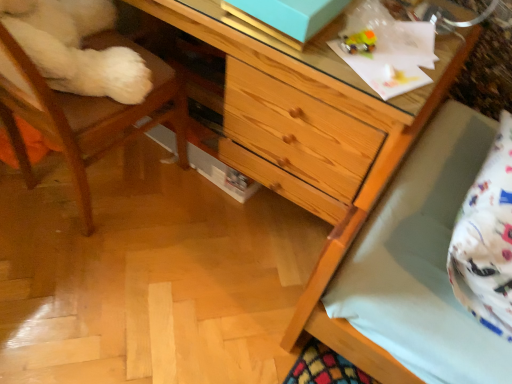
Question: Considering the relative positions of translucent plastic toy at upper right and wooden chest of drawers at center in the image provided, is translucent plastic toy at upper right behind wooden chest of drawers at center?

Choices:
 (A) yes
 (B) no

Answer: (A)

Question: From a real-world perspective, is translucent plastic toy at upper right over wooden chest of drawers at center?

Choices:
 (A) yes
 (B) no

Answer: (A)

Question: Is translucent plastic toy at upper right positioned with its back to wooden chest of drawers at center?

Choices:
 (A) yes
 (B) no

Answer: (A)

Question: Does translucent plastic toy at upper right have a larger size compared to wooden chest of drawers at center?

Choices:
 (A) yes
 (B) no

Answer: (B)

Question: Does translucent plastic toy at upper right have a greater width compared to wooden chest of drawers at center?

Choices:
 (A) yes
 (B) no

Answer: (B)

Question: Is translucent plastic toy at upper right thinner than wooden chest of drawers at center?

Choices:
 (A) yes
 (B) no

Answer: (A)

Question: From a real-world perspective, is translucent plastic toy at upper right on white cotton pillow at lower right?

Choices:
 (A) no
 (B) yes

Answer: (B)

Question: Can you confirm if translucent plastic toy at upper right is shorter than white cotton pillow at lower right?

Choices:
 (A) no
 (B) yes

Answer: (B)

Question: From the image's perspective, is translucent plastic toy at upper right below white cotton pillow at lower right?

Choices:
 (A) yes
 (B) no

Answer: (B)

Question: Would you say translucent plastic toy at upper right is outside white cotton pillow at lower right?

Choices:
 (A) no
 (B) yes

Answer: (B)

Question: Does translucent plastic toy at upper right appear on the right side of white cotton pillow at lower right?

Choices:
 (A) no
 (B) yes

Answer: (A)

Question: Is translucent plastic toy at upper right facing towards white cotton pillow at lower right?

Choices:
 (A) no
 (B) yes

Answer: (A)

Question: Could you tell me if wooden chair at left is turned towards wooden chest of drawers at center?

Choices:
 (A) yes
 (B) no

Answer: (A)